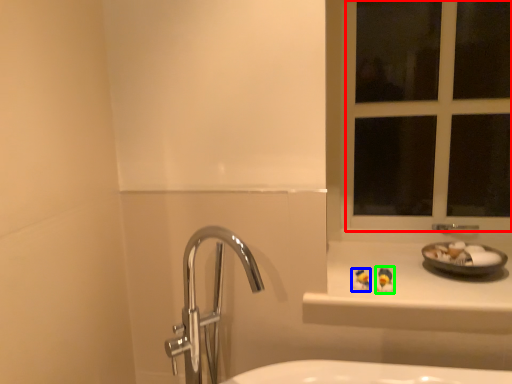
Question: Based on their relative distances, which object is farther from window frame (highlighted by a red box)? Choose from miniature (highlighted by a blue box) and miniature (highlighted by a green box).

Choices:
 (A) miniature
 (B) miniature

Answer: (A)